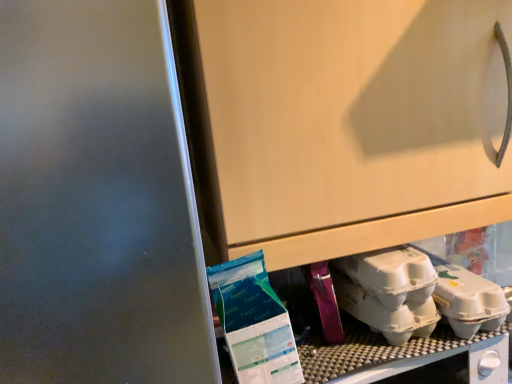
Question: Is white matte egg carton at lower right, which is the first yoghurt in right-to-left order, wider or thinner than blue plastic bag of yoghurt at lower left, positioned as the 2th yoghurt in right-to-left order?

Choices:
 (A) wide
 (B) thin

Answer: (A)

Question: From a real-world perspective, relative to blue plastic bag of yoghurt at lower left, placed as the first yoghurt when sorted from left to right, is white matte egg carton at lower right, which is the first yoghurt in right-to-left order, vertically above or below?

Choices:
 (A) below
 (B) above

Answer: (A)

Question: Is white matte egg carton at lower right, which is the first yoghurt in right-to-left order, spatially inside blue plastic bag of yoghurt at lower left, positioned as the 2th yoghurt in right-to-left order, or outside of it?

Choices:
 (A) outside
 (B) inside

Answer: (A)

Question: From a real-world perspective, is blue plastic bag of yoghurt at lower left, positioned as the 2th yoghurt in right-to-left order, physically located above or below white matte egg carton at lower right, arranged as the second yoghurt when viewed from the left?

Choices:
 (A) below
 (B) above

Answer: (B)

Question: From their relative heights in the image, would you say blue plastic bag of yoghurt at lower left, placed as the first yoghurt when sorted from left to right, is taller or shorter than white matte egg carton at lower right, which is the first yoghurt in right-to-left order?

Choices:
 (A) tall
 (B) short

Answer: (A)

Question: Is point (249, 307) positioned closer to the camera than point (385, 296)?

Choices:
 (A) farther
 (B) closer

Answer: (B)

Question: Considering the positions of blue plastic bag of yoghurt at lower left, placed as the first yoghurt when sorted from left to right, and white matte egg carton at lower right, which is the first yoghurt in right-to-left order, in the image, is blue plastic bag of yoghurt at lower left, placed as the first yoghurt when sorted from left to right, bigger or smaller than white matte egg carton at lower right, which is the first yoghurt in right-to-left order,?

Choices:
 (A) big
 (B) small

Answer: (A)